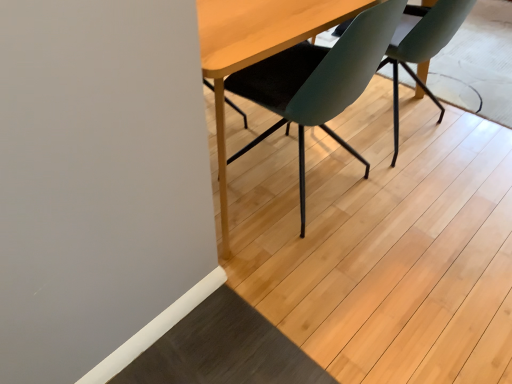
Where is `teal matte chair at center, which is the 1th chair from right to left`? The width and height of the screenshot is (512, 384). teal matte chair at center, which is the 1th chair from right to left is located at coordinates (422, 47).

This screenshot has height=384, width=512. What do you see at coordinates (422, 47) in the screenshot? I see `teal matte chair at center, the second chair when ordered from left to right` at bounding box center [422, 47].

The height and width of the screenshot is (384, 512). Find the location of `matte black chair at center, which is the second chair from right to left`. matte black chair at center, which is the second chair from right to left is located at coordinates (253, 52).

The height and width of the screenshot is (384, 512). Describe the element at coordinates (253, 52) in the screenshot. I see `matte black chair at center, which is the second chair from right to left` at that location.

In order to face matte black chair at center, which is the second chair from right to left, should I rotate leftwards or rightwards?

A 7.381 degree turn to the right will do.

Locate an element on the screen. The width and height of the screenshot is (512, 384). teal matte chair at center, which is the 1th chair from right to left is located at coordinates (422, 47).

Is matte black chair at center, which is the first chair in left-to-right order, to the right of teal matte chair at center, the second chair when ordered from left to right, from the viewer's perspective?

No.

Is matte black chair at center, which is the second chair from right to left, in front of teal matte chair at center, the second chair when ordered from left to right?

Yes, the depth of matte black chair at center, which is the second chair from right to left, is less than that of teal matte chair at center, the second chair when ordered from left to right.

Does point (265, 31) lie in front of point (401, 54)?

Yes, point (265, 31) is closer to viewer.

From the image's perspective, is matte black chair at center, which is the first chair in left-to-right order, located beneath teal matte chair at center, the second chair when ordered from left to right?

Correct, matte black chair at center, which is the first chair in left-to-right order, appears lower than teal matte chair at center, the second chair when ordered from left to right, in the image.

From a real-world perspective, is matte black chair at center, which is the second chair from right to left, positioned above or below teal matte chair at center, which is the 1th chair from right to left?

In terms of real-world spatial position, matte black chair at center, which is the second chair from right to left, is above teal matte chair at center, which is the 1th chair from right to left.

Can you confirm if matte black chair at center, which is the second chair from right to left, is thinner than teal matte chair at center, the second chair when ordered from left to right?

In fact, matte black chair at center, which is the second chair from right to left, might be wider than teal matte chair at center, the second chair when ordered from left to right.

Considering the relative sizes of matte black chair at center, which is the second chair from right to left, and teal matte chair at center, the second chair when ordered from left to right, in the image provided, is matte black chair at center, which is the second chair from right to left, shorter than teal matte chair at center, the second chair when ordered from left to right,?

No.

In terms of size, does matte black chair at center, which is the second chair from right to left, appear bigger or smaller than teal matte chair at center, which is the 1th chair from right to left?

Clearly, matte black chair at center, which is the second chair from right to left, is larger in size than teal matte chair at center, which is the 1th chair from right to left.

Is matte black chair at center, which is the second chair from right to left, situated inside teal matte chair at center, the second chair when ordered from left to right, or outside?

The correct answer is: outside.

Is matte black chair at center, which is the first chair in left-to-right order, directly adjacent to teal matte chair at center, which is the 1th chair from right to left?

No, matte black chair at center, which is the first chair in left-to-right order, is not with teal matte chair at center, which is the 1th chair from right to left.

Is matte black chair at center, which is the first chair in left-to-right order, turned away from teal matte chair at center, which is the 1th chair from right to left?

No, matte black chair at center, which is the first chair in left-to-right order, is not facing away from teal matte chair at center, which is the 1th chair from right to left.

The width and height of the screenshot is (512, 384). Find the location of `chair on the left of the teal matte chair at center, the second chair when ordered from left to right`. chair on the left of the teal matte chair at center, the second chair when ordered from left to right is located at coordinates (253, 52).

Which object is positioned more to the right, teal matte chair at center, which is the 1th chair from right to left, or matte black chair at center, which is the first chair in left-to-right order?

Positioned to the right is teal matte chair at center, which is the 1th chair from right to left.

Who is more distant, teal matte chair at center, which is the 1th chair from right to left, or matte black chair at center, which is the second chair from right to left?

teal matte chair at center, which is the 1th chair from right to left, is further away from the camera.

Considering the positions of points (396, 47) and (248, 81), is point (396, 47) closer to camera compared to point (248, 81)?

No, (396, 47) is behind (248, 81).

From the image's perspective, relative to matte black chair at center, which is the second chair from right to left, is teal matte chair at center, which is the 1th chair from right to left, above or below?

Clearly, from the image's perspective, teal matte chair at center, which is the 1th chair from right to left, is above matte black chair at center, which is the second chair from right to left.

From a real-world perspective, who is located higher, teal matte chair at center, which is the 1th chair from right to left, or matte black chair at center, which is the first chair in left-to-right order?

matte black chair at center, which is the first chair in left-to-right order, from a real-world perspective.

Based on the photo, can you confirm if teal matte chair at center, which is the 1th chair from right to left, is wider than matte black chair at center, which is the second chair from right to left?

In fact, teal matte chair at center, which is the 1th chair from right to left, might be narrower than matte black chair at center, which is the second chair from right to left.

Is teal matte chair at center, the second chair when ordered from left to right, taller than matte black chair at center, which is the second chair from right to left?

No.

Does teal matte chair at center, which is the 1th chair from right to left, have a larger size compared to matte black chair at center, which is the second chair from right to left?

Incorrect, teal matte chair at center, which is the 1th chair from right to left, is not larger than matte black chair at center, which is the second chair from right to left.

Is matte black chair at center, which is the second chair from right to left, inside teal matte chair at center, which is the 1th chair from right to left?

No.

Is teal matte chair at center, which is the 1th chair from right to left, touching matte black chair at center, which is the second chair from right to left?

No, teal matte chair at center, which is the 1th chair from right to left, is not in contact with matte black chair at center, which is the second chair from right to left.

Is teal matte chair at center, which is the 1th chair from right to left, facing towards matte black chair at center, which is the second chair from right to left?

Result: No, teal matte chair at center, which is the 1th chair from right to left, is not turned towards matte black chair at center, which is the second chair from right to left.

Locate an element on the screen. The image size is (512, 384). chair on the left of teal matte chair at center, the second chair when ordered from left to right is located at coordinates (253, 52).

I want to click on chair on the right of matte black chair at center, which is the second chair from right to left, so click(422, 47).

The height and width of the screenshot is (384, 512). I want to click on chair that appears below the matte black chair at center, which is the first chair in left-to-right order (from a real-world perspective), so click(x=422, y=47).